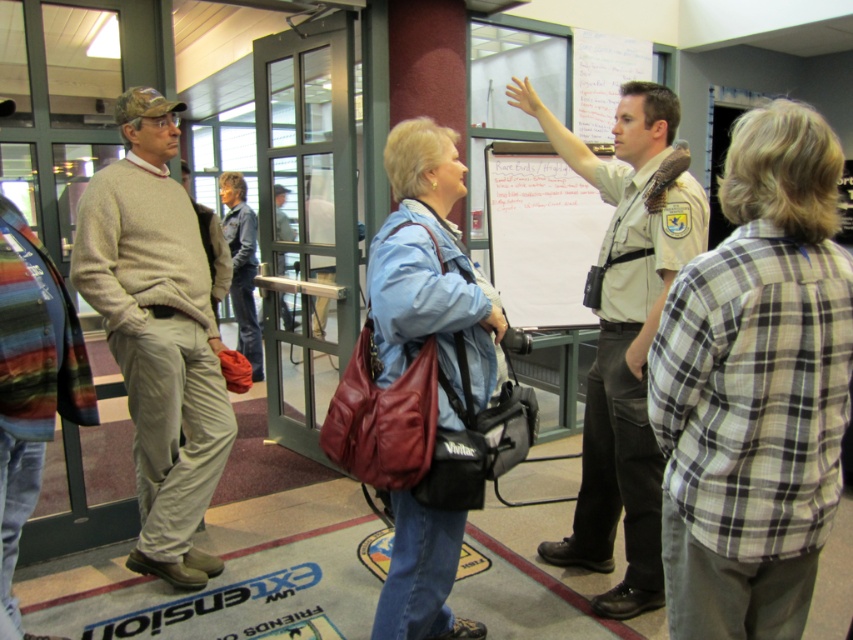
Question: Is light brown uniform at center to the right of light brown leather jacket at center from the viewer's perspective?

Choices:
 (A) yes
 (B) no

Answer: (A)

Question: Can you confirm if light gray sweater at left is positioned to the left of denim jacket at center?

Choices:
 (A) no
 (B) yes

Answer: (A)

Question: Which point is closer to the camera taking this photo?

Choices:
 (A) (238, 241)
 (B) (296, 51)
 (C) (631, 237)
 (D) (209, 323)

Answer: (C)

Question: Is light gray sweater at left wider than denim jacket at center?

Choices:
 (A) yes
 (B) no

Answer: (A)

Question: Which of these objects is positioned farthest from the light brown leather jacket at center?

Choices:
 (A) light gray sweater at left
 (B) white paper at center
 (C) light brown uniform at center
 (D) striped wool sweater at left

Answer: (D)

Question: Which object appears farthest from the camera in this image?

Choices:
 (A) white paper at center
 (B) light brown uniform at center

Answer: (A)